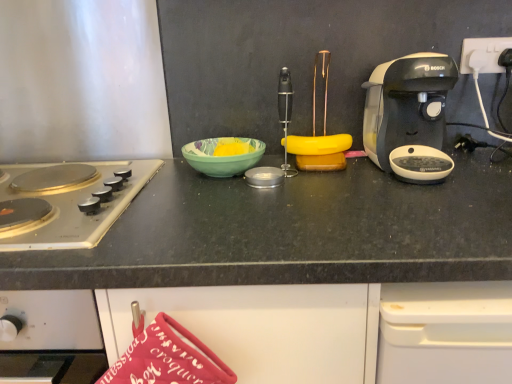
I want to click on vacant space to the right of black plastic coffee maker at right, so click(x=482, y=164).